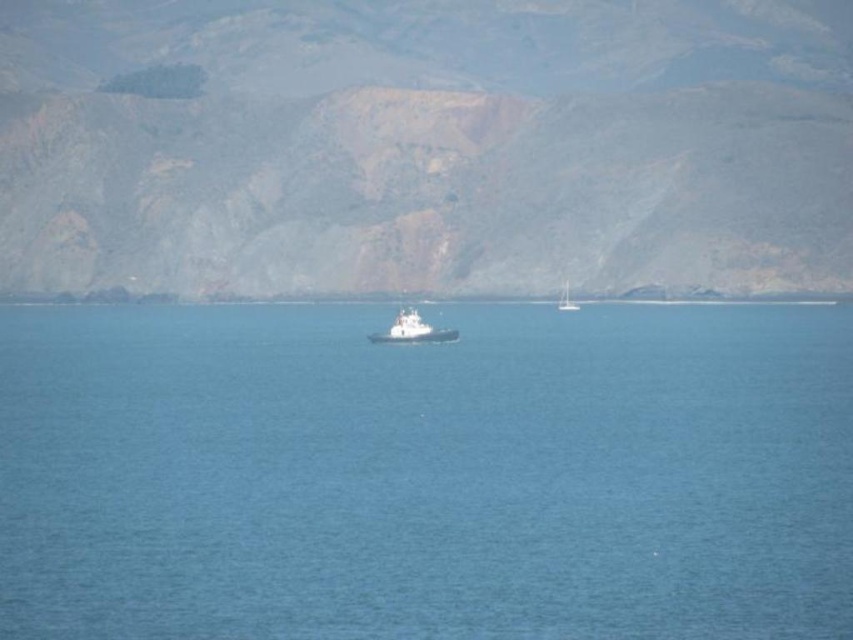
Is brown rocky mountain at center positioned before white matte boat at center?

No, brown rocky mountain at center is behind white matte boat at center.

Does point (550, 116) come closer to viewer compared to point (379, 337)?

No, (550, 116) is further to viewer.

Does point (534, 96) come in front of point (410, 308)?

No.

Identify the location of brown rocky mountain at center. (424, 145).

Who is positioned more to the left, white matte boat at center or white plastic boat at center?

white matte boat at center

Who is shorter, white matte boat at center or white plastic boat at center?

white plastic boat at center

Who is more forward, (456, 330) or (561, 310)?

Point (456, 330) is in front.

I want to click on white matte boat at center, so click(412, 330).

Which is in front, point (187, 557) or point (386, 77)?

Positioned in front is point (187, 557).

Image resolution: width=853 pixels, height=640 pixels. Describe the element at coordinates (425, 474) in the screenshot. I see `blue water at center` at that location.

Identify the location of blue water at center. This screenshot has height=640, width=853. (425, 474).